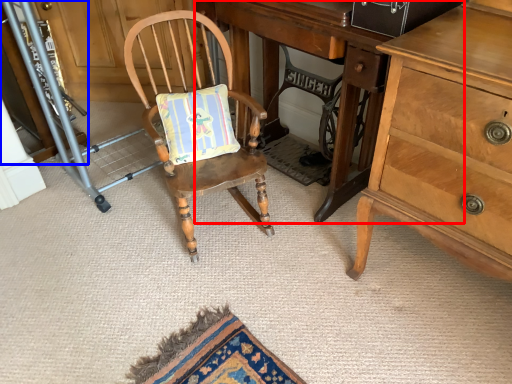
Question: Among these objects, which one is farthest to the camera, desk (highlighted by a red box) or cabinetry (highlighted by a blue box)?

Choices:
 (A) desk
 (B) cabinetry

Answer: (B)